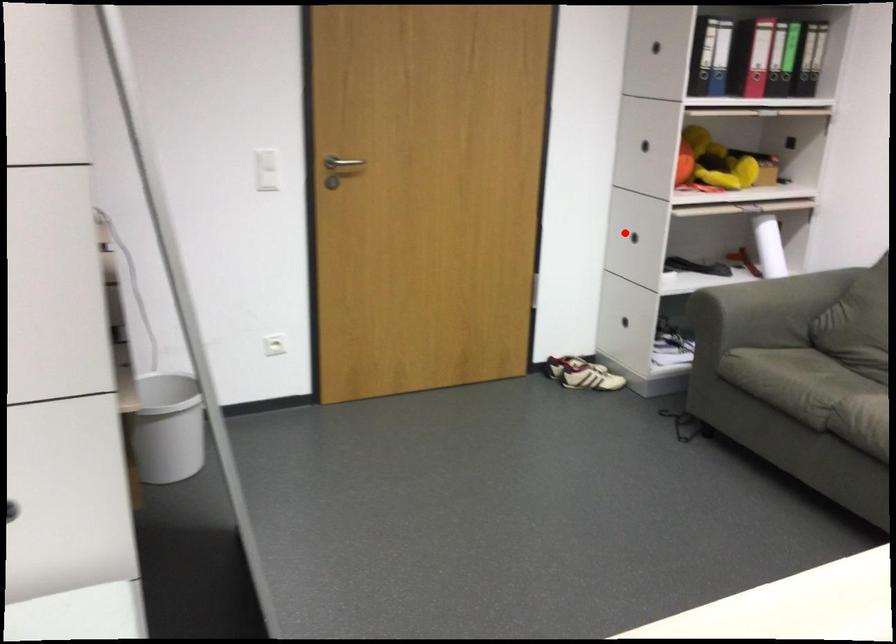
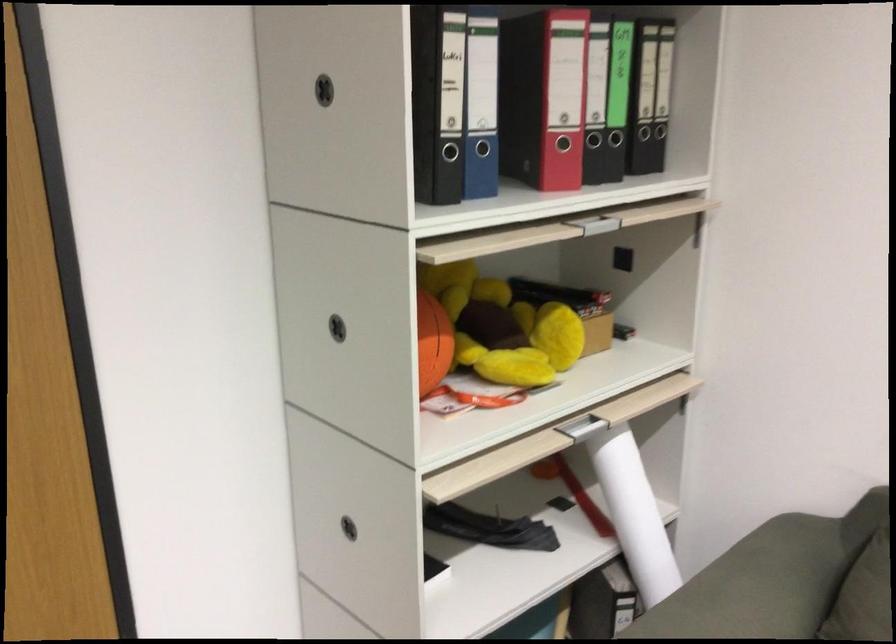
In the second image, find the point that corresponds to the highlighted location in the first image.

(348, 527)